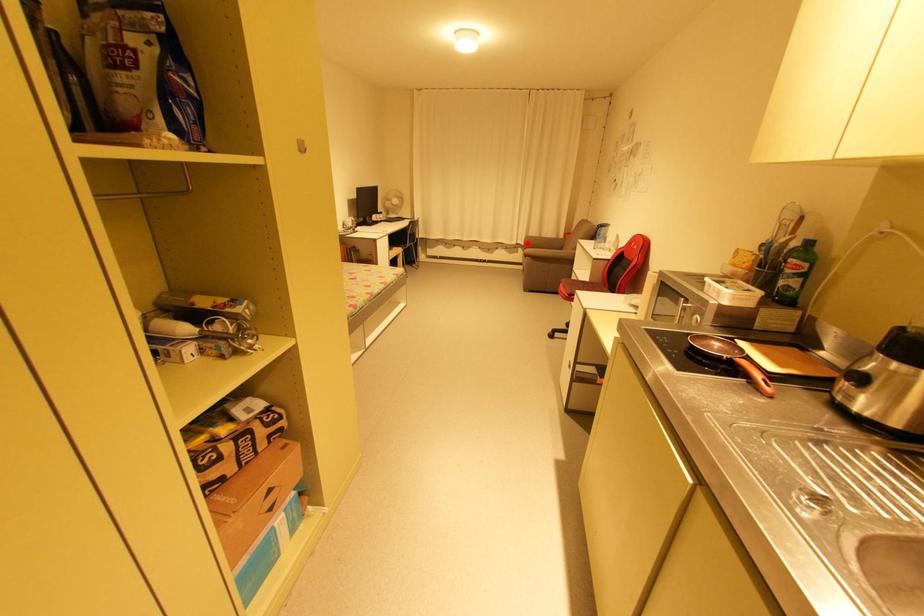
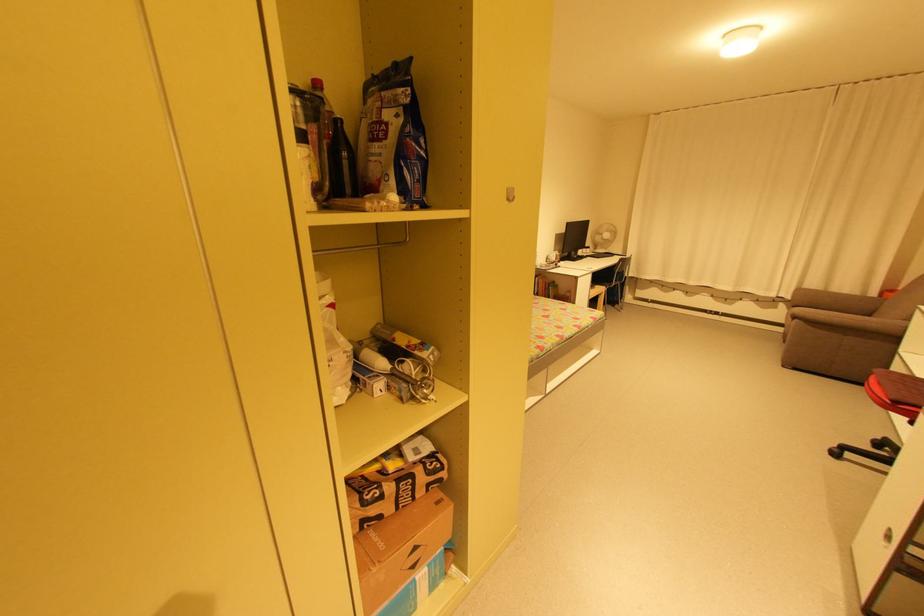
Question: I am providing you with two images of the same scene from different viewpoints. A red point is shown in image1. For the corresponding object point in image2, is it positioned nearer or farther from the camera?

Choices:
 (A) Nearer
 (B) Farther

Answer: (B)